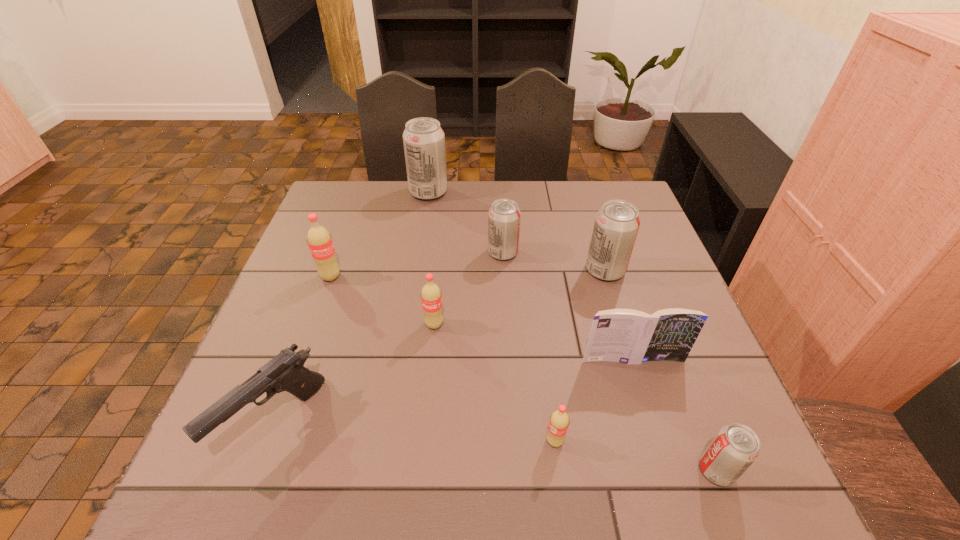
At what (x,y) coordinates should I click in order to perform the action: click on free point between the third nearest soda can and the smallest gray soda can. Please return your answer as a coordinate pair (x, y). This screenshot has width=960, height=540. Looking at the image, I should click on (575, 397).

Identify the location of unoccupied position between the rightmost gray soda can and the black gun. The image size is (960, 540). (495, 447).

The image size is (960, 540). Find the location of `free space that is in between the fourth soda can from right to left and the second soda can from right to left`. free space that is in between the fourth soda can from right to left and the second soda can from right to left is located at coordinates (554, 261).

Image resolution: width=960 pixels, height=540 pixels. I want to click on free spot between the third smallest gray soda can and the second gray soda can from left to right, so click(x=554, y=261).

Locate an element on the screen. The width and height of the screenshot is (960, 540). free space between the nearest gray soda can and the third soda can from right to left is located at coordinates (636, 456).

Locate an element on the screen. Image resolution: width=960 pixels, height=540 pixels. empty space that is in between the third gray soda can from right to left and the black gun is located at coordinates (389, 338).

Identify which object is the sixth nearest to the book. Please provide its 2D coordinates. Your answer should be formatted as a tuple, i.e. [(x, y)], where the tuple contains the x and y coordinates of a point satisfying the conditions above.

[(285, 372)]

Identify the location of the closest object to the third gray soda can from left to right. (504, 216).

Locate an element on the screen. This screenshot has width=960, height=540. the fourth closest soda can relative to the nearest gray soda can is located at coordinates point(504,216).

Point out which soda can is positioned as the fourth nearest to the sixth soda can from left to right. Please provide its 2D coordinates. Your answer should be formatted as a tuple, i.e. [(x, y)], where the tuple contains the x and y coordinates of a point satisfying the conditions above.

[(735, 447)]